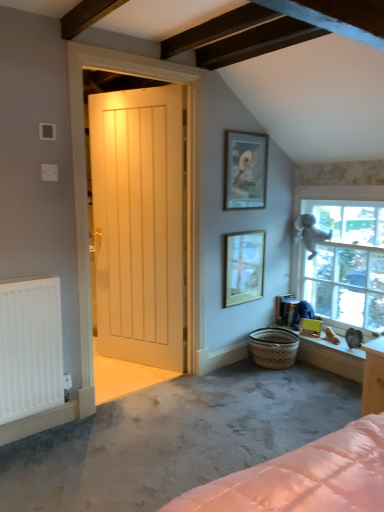
The width and height of the screenshot is (384, 512). Identify the location of free point above clear glass window at upper right (from a real-world perspective). (343, 187).